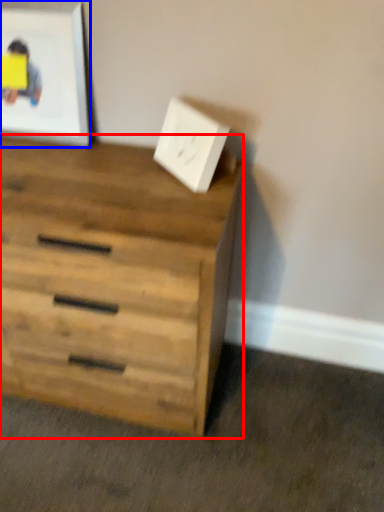
Question: Which object is closer to the camera taking this photo, chest of drawers (highlighted by a red box) or picture frame (highlighted by a blue box)?

Choices:
 (A) chest of drawers
 (B) picture frame

Answer: (A)